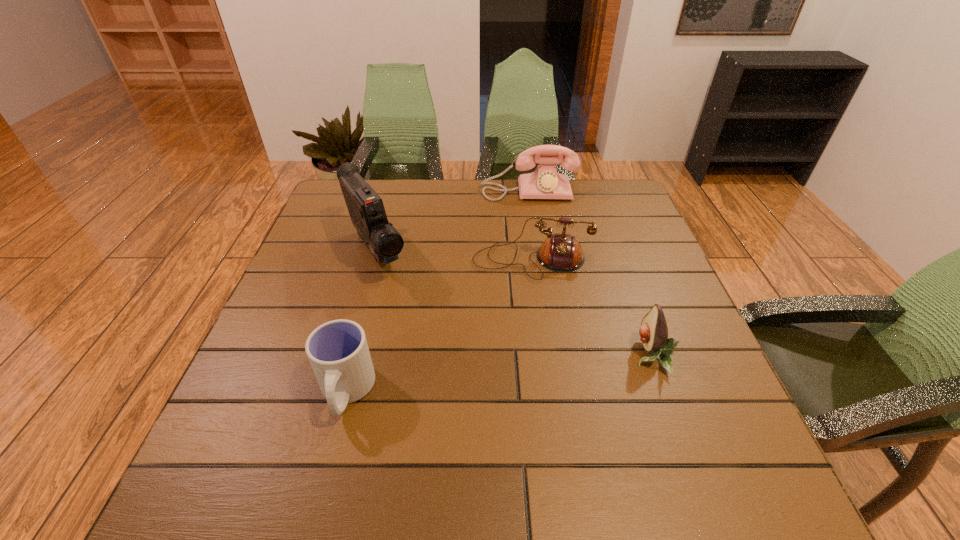
This screenshot has height=540, width=960. I want to click on free spot between the farthest object and the camcorder, so click(452, 221).

You are a GUI agent. You are given a task and a screenshot of the screen. Output one action in this format:
    pyautogui.click(x=<x>, y=<y>)
    Task: Click on the empty location between the rightmost object and the tallest object
    The image size is (960, 540).
    Given the screenshot: What is the action you would take?
    pyautogui.click(x=514, y=303)

This screenshot has width=960, height=540. What are the coordinates of `blank region between the fourth shortest object and the avocado` in the screenshot? It's located at (589, 273).

This screenshot has width=960, height=540. I want to click on free space that is in between the farther telephone and the avocado, so click(x=589, y=273).

Identify which object is the second closest to the avocado. Please provide its 2D coordinates. Your answer should be formatted as a tuple, i.e. [(x, y)], where the tuple contains the x and y coordinates of a point satisfying the conditions above.

[(366, 209)]

You are a GUI agent. You are given a task and a screenshot of the screen. Output one action in this format:
    pyautogui.click(x=<x>, y=<y>)
    Task: Click on the second closest object relative to the rightmost object
    The image size is (960, 540).
    Given the screenshot: What is the action you would take?
    pyautogui.click(x=366, y=209)

You are a GUI agent. You are given a task and a screenshot of the screen. Output one action in this format:
    pyautogui.click(x=<x>, y=<y>)
    Task: Click on the free region that satisfies the following two spatial constraints: 1. on the front side of the shorter telephone; 2. on the seed side of the avocado
    This screenshot has height=540, width=960.
    Given the screenshot: What is the action you would take?
    pyautogui.click(x=545, y=356)

At what (x,y) coordinates should I click in order to perform the action: click on free location that satisfies the following two spatial constraints: 1. on the front side of the nearer telephone; 2. on the right side of the tallest object. Please return your answer as a coordinate pair (x, y). The height and width of the screenshot is (540, 960). Looking at the image, I should click on pos(373,261).

What are the coordinates of `blank area in the image that satisfies the following two spatial constraints: 1. on the front side of the avocado; 2. on the seed side of the shorter telephone` in the screenshot? It's located at (545, 356).